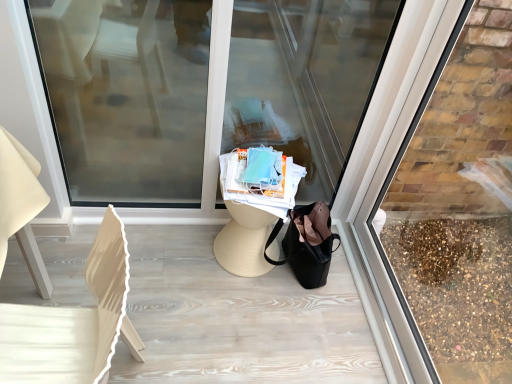
Find the location of `vacant area that lies in front of transparent glass shop window at center, the second shop window positioned from the right`. vacant area that lies in front of transparent glass shop window at center, the second shop window positioned from the right is located at coordinates (206, 290).